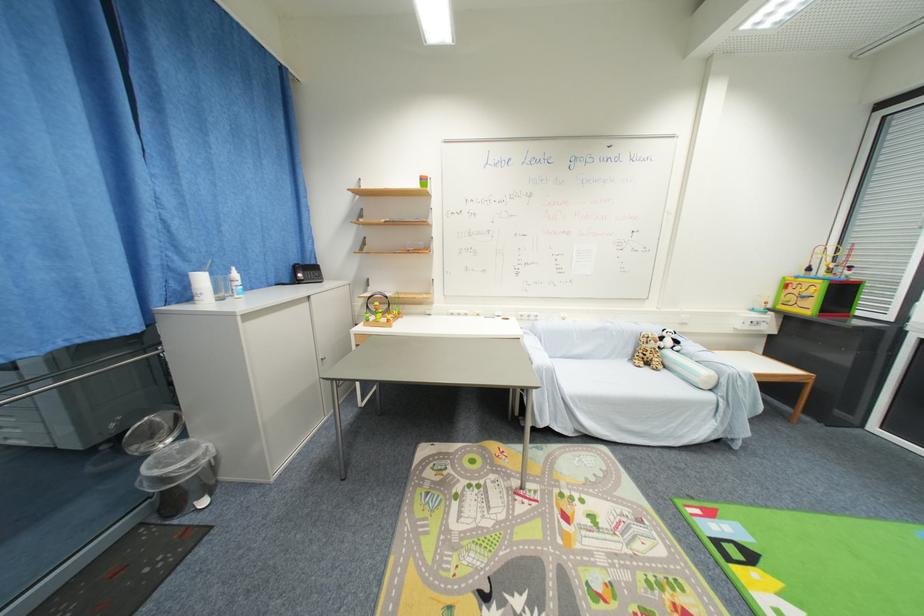
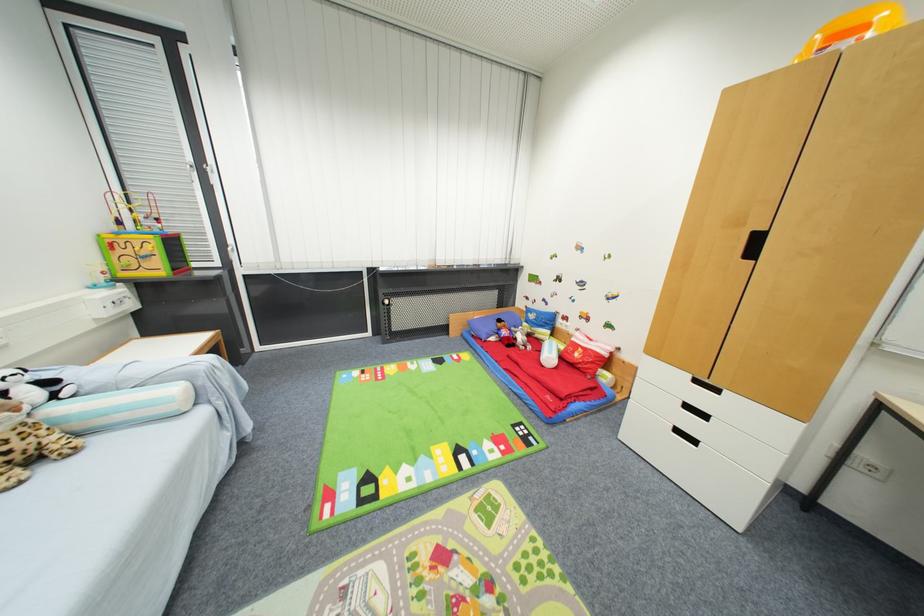
Find the pixel in the second image that matches (x=650, y=358) in the first image.

(7, 456)